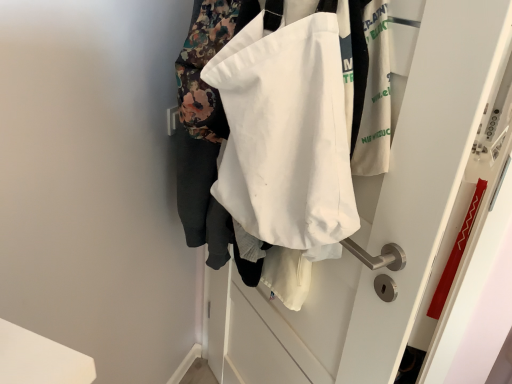
This screenshot has width=512, height=384. What do you see at coordinates (387, 219) in the screenshot?
I see `white fabric bag at center` at bounding box center [387, 219].

Measure the distance between point (x=268, y=227) and camera.

The distance of point (x=268, y=227) from camera is 33.31 inches.

Identify the location of white fabric bag at center. (387, 219).

Identify the location of white fabric bag at center. (387, 219).